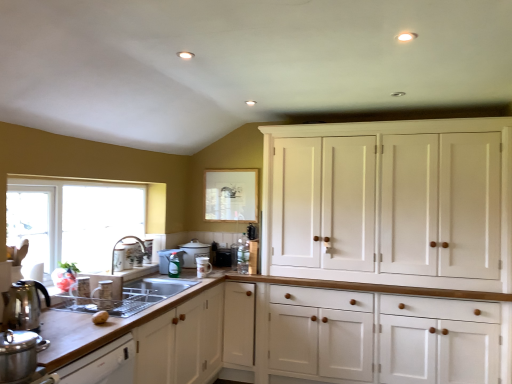
Question: Is the depth of matte white teapot at center, arranged as the fifth appliance when viewed from the front, greater than that of matte white cup at sink, which is counted as the second appliance, starting from the front?

Choices:
 (A) yes
 (B) no

Answer: (A)

Question: From a real-world perspective, is matte white teapot at center, arranged as the fifth appliance when viewed from the front, on top of matte white cup at sink, which is counted as the second appliance, starting from the front?

Choices:
 (A) yes
 (B) no

Answer: (A)

Question: Considering the relative positions of matte white teapot at center, the 2th appliance in the back-to-front sequence, and matte white cup at sink, which is counted as the second appliance, starting from the front, in the image provided, is matte white teapot at center, the 2th appliance in the back-to-front sequence, to the right of matte white cup at sink, which is counted as the second appliance, starting from the front, from the viewer's perspective?

Choices:
 (A) yes
 (B) no

Answer: (A)

Question: Would you say matte white teapot at center, arranged as the fifth appliance when viewed from the front, contains matte white cup at sink, which is counted as the second appliance, starting from the front?

Choices:
 (A) no
 (B) yes

Answer: (A)

Question: Is matte white teapot at center, arranged as the fifth appliance when viewed from the front, at the left side of matte white cup at sink, which is counted as the second appliance, starting from the front?

Choices:
 (A) no
 (B) yes

Answer: (A)

Question: Is matte white teapot at center, the 2th appliance in the back-to-front sequence, not near matte white cup at sink, which is counted as the second appliance, starting from the front?

Choices:
 (A) yes
 (B) no

Answer: (A)

Question: Does matte white teapot at center, the 2th appliance in the back-to-front sequence, appear on the left side of black matte toaster at center, which ranks as the 1th appliance in back-to-front order?

Choices:
 (A) yes
 (B) no

Answer: (A)

Question: Are matte white teapot at center, arranged as the fifth appliance when viewed from the front, and black matte toaster at center, which ranks as the sixth appliance in front-to-back order, making contact?

Choices:
 (A) no
 (B) yes

Answer: (A)

Question: From a real-world perspective, is matte white teapot at center, the 2th appliance in the back-to-front sequence, under black matte toaster at center, which ranks as the 1th appliance in back-to-front order?

Choices:
 (A) yes
 (B) no

Answer: (B)

Question: From the image's perspective, is matte white teapot at center, the 2th appliance in the back-to-front sequence, above black matte toaster at center, which ranks as the sixth appliance in front-to-back order?

Choices:
 (A) yes
 (B) no

Answer: (A)

Question: Are matte white teapot at center, arranged as the fifth appliance when viewed from the front, and black matte toaster at center, which ranks as the sixth appliance in front-to-back order, located far from each other?

Choices:
 (A) no
 (B) yes

Answer: (A)

Question: Is matte white teapot at center, arranged as the fifth appliance when viewed from the front, behind black matte toaster at center, which ranks as the sixth appliance in front-to-back order?

Choices:
 (A) no
 (B) yes

Answer: (A)

Question: From a real-world perspective, is brown matte potato at lower left under matte white cup at sink, which is the 5th appliance in back-to-front order?

Choices:
 (A) no
 (B) yes

Answer: (B)